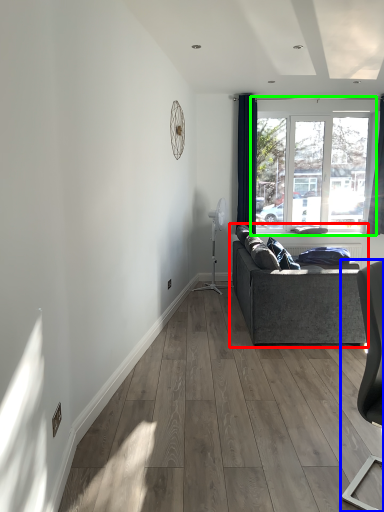
Question: Considering the real-world distances, which object is closest to studio couch (highlighted by a red box)? chair (highlighted by a blue box) or window (highlighted by a green box).

Choices:
 (A) chair
 (B) window

Answer: (A)